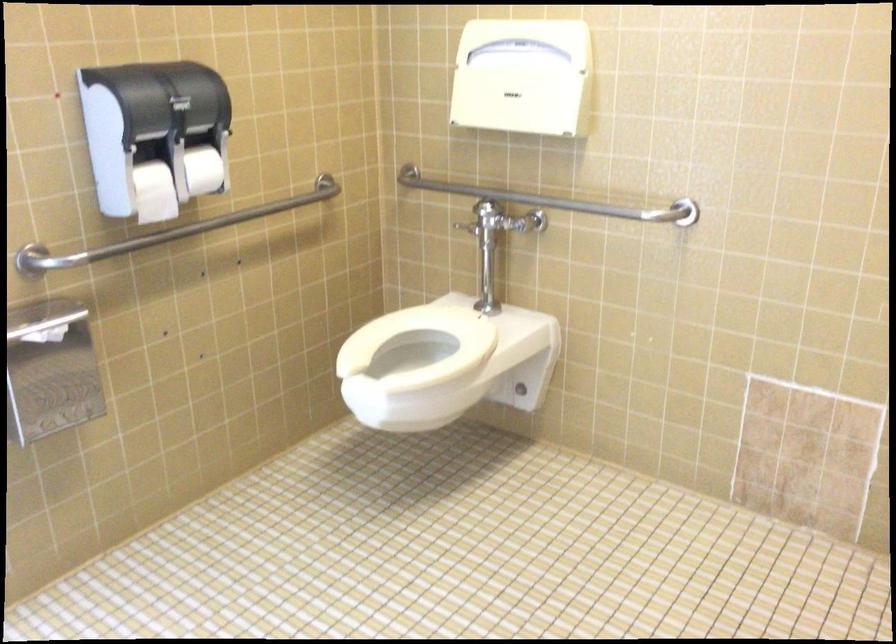
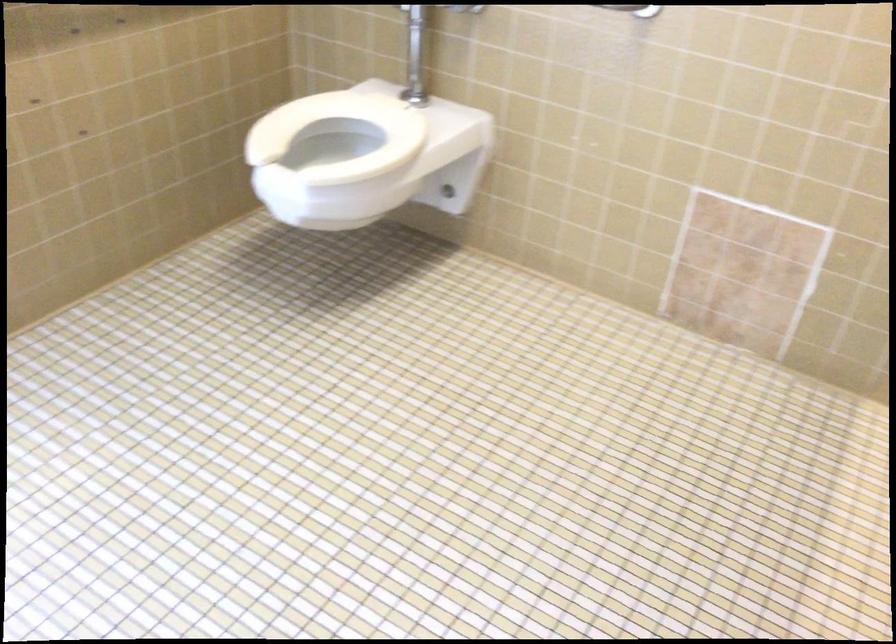
Where in the second image is the point corresponding to (x=419, y=339) from the first image?

(339, 134)